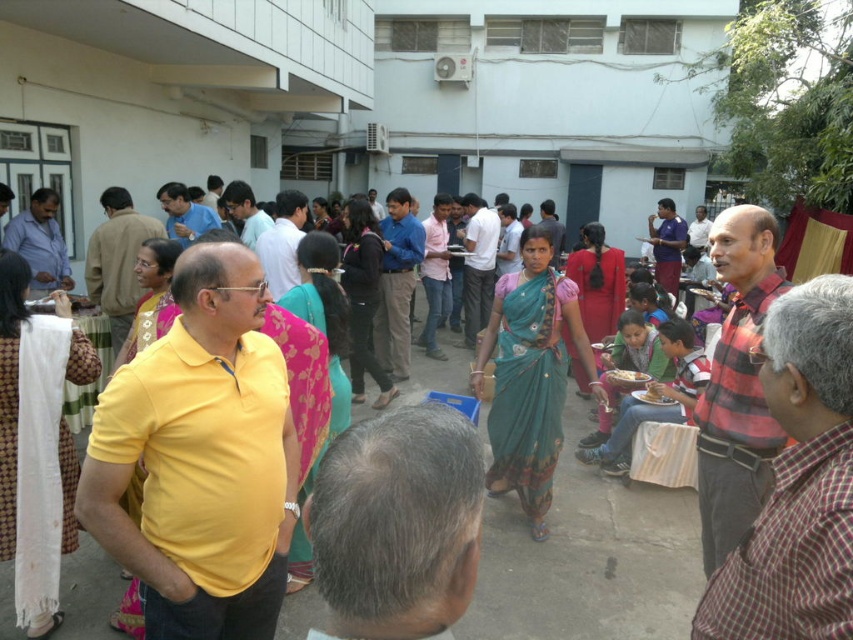
Question: Does green sari at center have a larger size compared to white ceramic bowl at center?

Choices:
 (A) no
 (B) yes

Answer: (B)

Question: Which point is farther to the camera?

Choices:
 (A) (611, 374)
 (B) (583, 538)

Answer: (A)

Question: Among these objects, which one is farthest from the camera?

Choices:
 (A) green sari at center
 (B) white ceramic bowl at center

Answer: (B)

Question: Which of the following is the closest to the observer?

Choices:
 (A) green sari at center
 (B) white ceramic bowl at center

Answer: (A)

Question: Is green sari at center to the left of white ceramic bowl at center from the viewer's perspective?

Choices:
 (A) yes
 (B) no

Answer: (A)

Question: Is green sari at center thinner than white ceramic bowl at center?

Choices:
 (A) yes
 (B) no

Answer: (B)